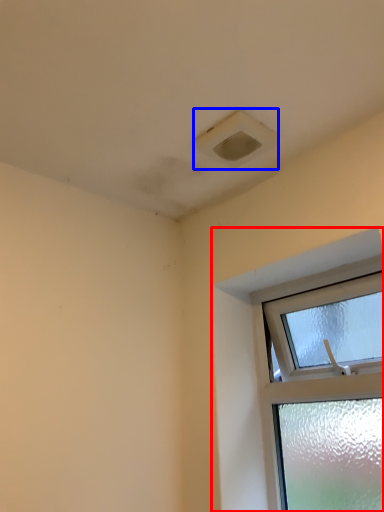
Question: Which of the following is the farthest to the observer, window (highlighted by a red box) or air conditioning (highlighted by a blue box)?

Choices:
 (A) window
 (B) air conditioning

Answer: (B)